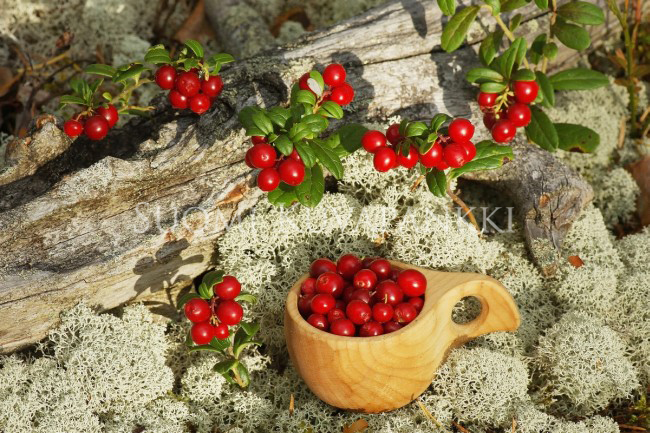
Find the location of a particular element. handle is located at coordinates (462, 318).